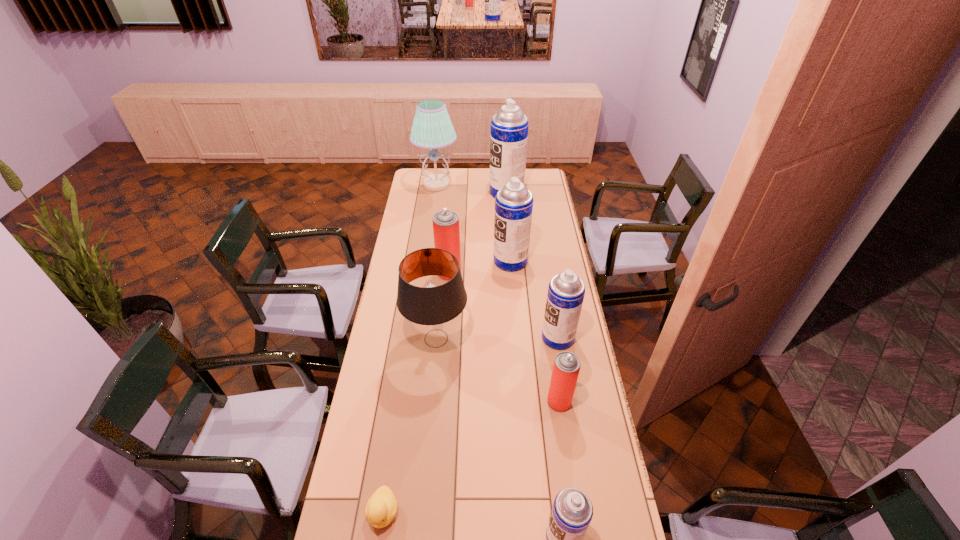
Where is `unoccupied position between the farther red aerosol can and the farthest blue aerosol can`? Image resolution: width=960 pixels, height=540 pixels. unoccupied position between the farther red aerosol can and the farthest blue aerosol can is located at coordinates (478, 233).

The height and width of the screenshot is (540, 960). Find the location of `vacant space that is in between the nearer red aerosol can and the lampshade`. vacant space that is in between the nearer red aerosol can and the lampshade is located at coordinates (497, 370).

Identify the location of object that is the eighth closest one to the smallest blue aerosol can. The width and height of the screenshot is (960, 540). (432, 128).

Locate which object ranks in proximity to the shortest object. Please provide its 2D coordinates. Your answer should be formatted as a tuple, i.e. [(x, y)], where the tuple contains the x and y coordinates of a point satisfying the conditions above.

[(572, 511)]

Image resolution: width=960 pixels, height=540 pixels. I want to click on aerosol can that can be found as the fifth closest to the biggest blue aerosol can, so click(x=572, y=511).

The height and width of the screenshot is (540, 960). What are the coordinates of `aerosol can object that ranks as the third closest to the duck` in the screenshot? It's located at (566, 291).

Identify the location of the third closest blue aerosol can to the fourth farthest aerosol can. (509, 127).

Find the location of a particular element. This screenshot has width=960, height=540. the closest blue aerosol can to the gray lampshade is located at coordinates (x=514, y=202).